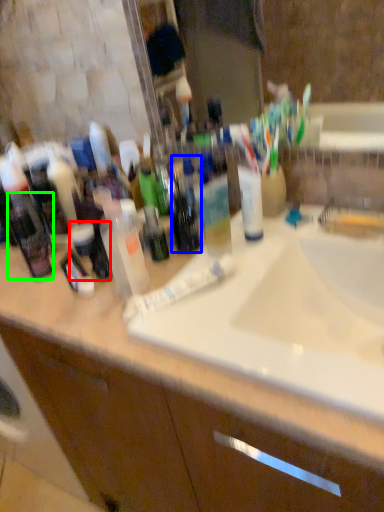
Question: Which is nearer to the toiletry (highlighted by a red box)? bottle (highlighted by a blue box) or toiletry (highlighted by a green box).

Choices:
 (A) bottle
 (B) toiletry

Answer: (B)